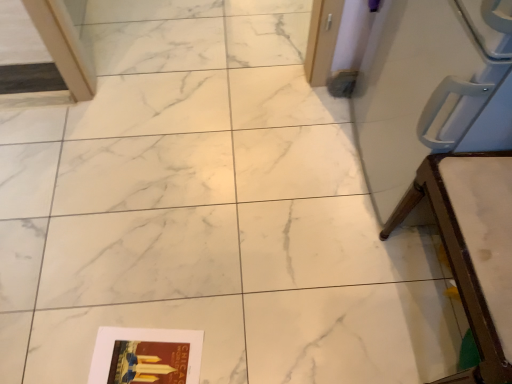
At what (x,y) coordinates should I click in order to perform the action: click on blank space above matte paper magazine at lower left (from a real-world perspective). Please return your answer as a coordinate pair (x, y). Image resolution: width=512 pixels, height=384 pixels. Looking at the image, I should click on (143, 357).